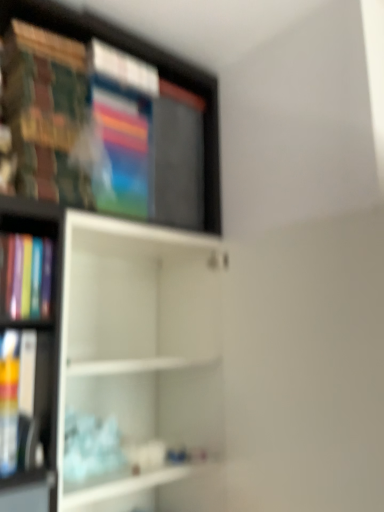
Question: Is the depth of white matte shelf at center, arranged as the second shelf when viewed from the top, greater than that of matte plastic book at left?

Choices:
 (A) yes
 (B) no

Answer: (B)

Question: Is white matte shelf at center, the first shelf ordered from the bottom, to the right of matte plastic book at left from the viewer's perspective?

Choices:
 (A) no
 (B) yes

Answer: (B)

Question: Does white matte shelf at center, the first shelf ordered from the bottom, have a greater height compared to matte plastic book at left?

Choices:
 (A) yes
 (B) no

Answer: (A)

Question: Considering the relative sizes of white matte shelf at center, arranged as the second shelf when viewed from the top, and matte plastic book at left in the image provided, is white matte shelf at center, arranged as the second shelf when viewed from the top, wider than matte plastic book at left?

Choices:
 (A) yes
 (B) no

Answer: (A)

Question: Can you confirm if white matte shelf at center, the first shelf ordered from the bottom, is shorter than matte plastic book at left?

Choices:
 (A) yes
 (B) no

Answer: (B)

Question: Is white matte shelf at center, the first shelf ordered from the bottom, smaller than matte plastic book at left?

Choices:
 (A) no
 (B) yes

Answer: (A)

Question: Is matte plastic book at left further to camera compared to white matte shelf at center, arranged as the second shelf when viewed from the top?

Choices:
 (A) no
 (B) yes

Answer: (B)

Question: Is matte plastic book at left in contact with white matte shelf at center, the first shelf ordered from the bottom?

Choices:
 (A) no
 (B) yes

Answer: (A)

Question: From the image's perspective, is matte plastic book at left beneath white matte shelf at center, the first shelf ordered from the bottom?

Choices:
 (A) yes
 (B) no

Answer: (B)

Question: Does matte plastic book at left appear on the right side of white matte shelf at center, the first shelf ordered from the bottom?

Choices:
 (A) no
 (B) yes

Answer: (A)

Question: Considering the relative sizes of matte plastic book at left and white matte shelf at center, the first shelf ordered from the bottom, in the image provided, is matte plastic book at left smaller than white matte shelf at center, the first shelf ordered from the bottom,?

Choices:
 (A) no
 (B) yes

Answer: (B)

Question: Is the position of matte plastic book at left less distant than that of white matte shelf at center, the first shelf ordered from the bottom?

Choices:
 (A) yes
 (B) no

Answer: (B)

Question: Could matte plastic book at left be considered to be inside wooden bookshelf at upper left, arranged as the second shelf when ordered from the bottom?

Choices:
 (A) yes
 (B) no

Answer: (B)